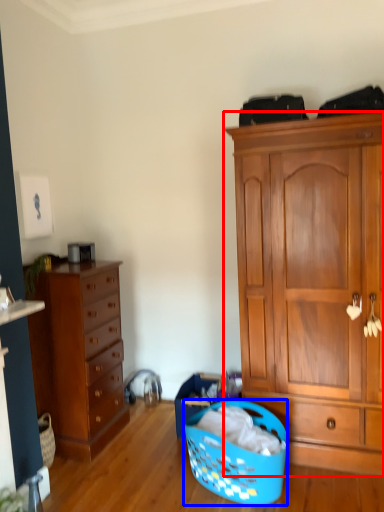
Question: Which object appears farthest to the camera in this image, cabinetry (highlighted by a red box) or picnic basket (highlighted by a blue box)?

Choices:
 (A) cabinetry
 (B) picnic basket

Answer: (A)